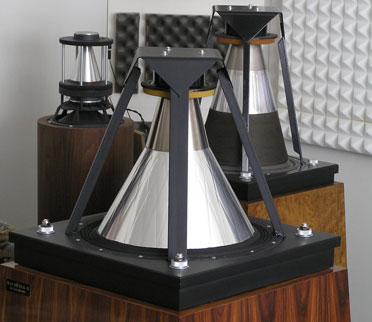
Find the location of a particular element. The image size is (372, 322). left corner side is located at coordinates (366, 3).